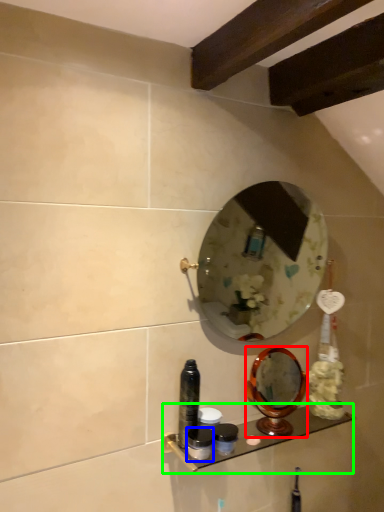
Question: Which is farther away from mirror (highlighted by a red box)? toiletry (highlighted by a blue box) or shelf (highlighted by a green box)?

Choices:
 (A) toiletry
 (B) shelf

Answer: (A)